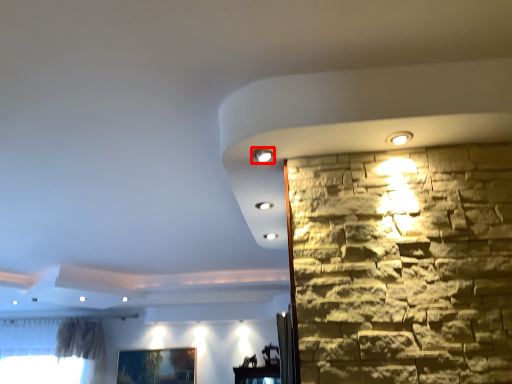
Question: From the image's perspective, considering the relative positions of light (annotated by the red box) and picture frame in the image provided, where is light (annotated by the red box) located with respect to the staircase?

Choices:
 (A) above
 (B) below

Answer: (A)